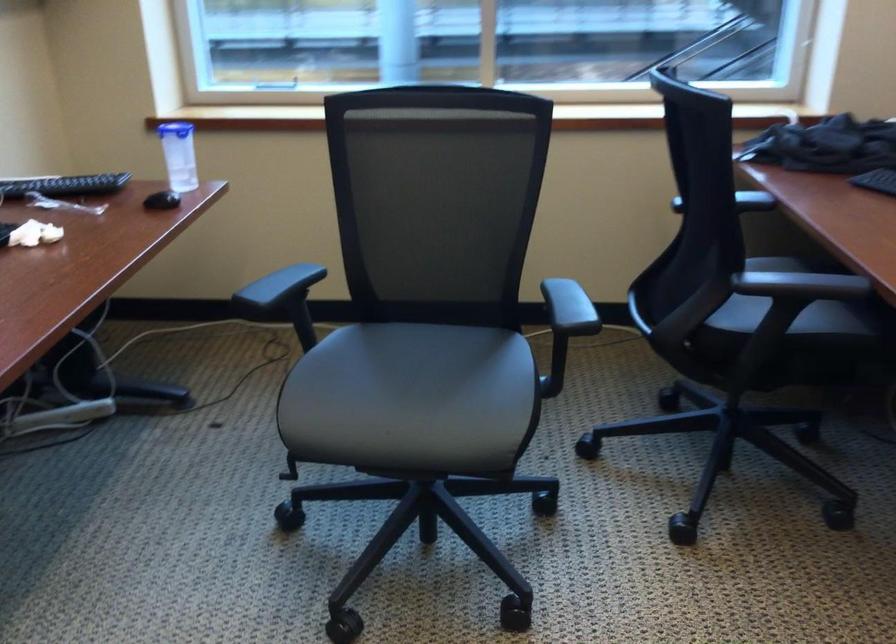
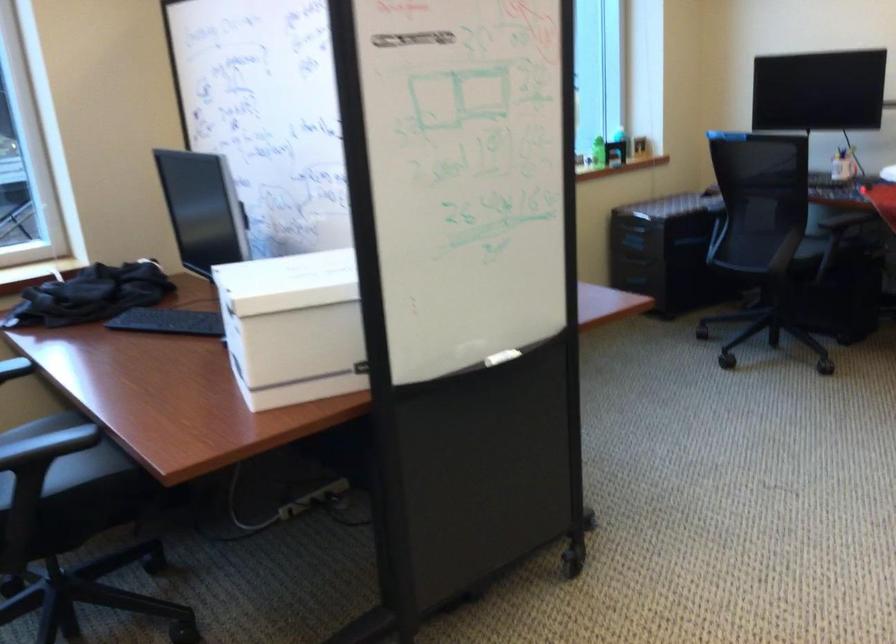
Question: How did the camera likely rotate?

Choices:
 (A) Left
 (B) Right
 (C) Up
 (D) Down

Answer: (B)